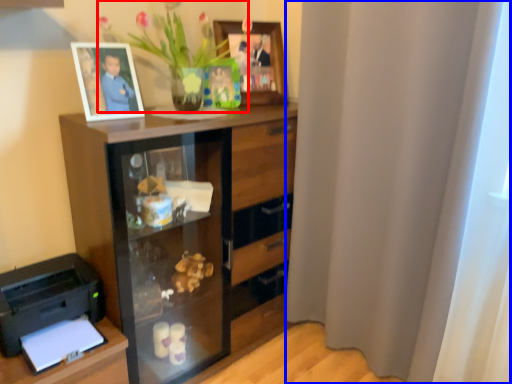
Question: Which of the following is the closest to the observer, floral arrangement (highlighted by a red box) or curtain (highlighted by a blue box)?

Choices:
 (A) floral arrangement
 (B) curtain

Answer: (B)